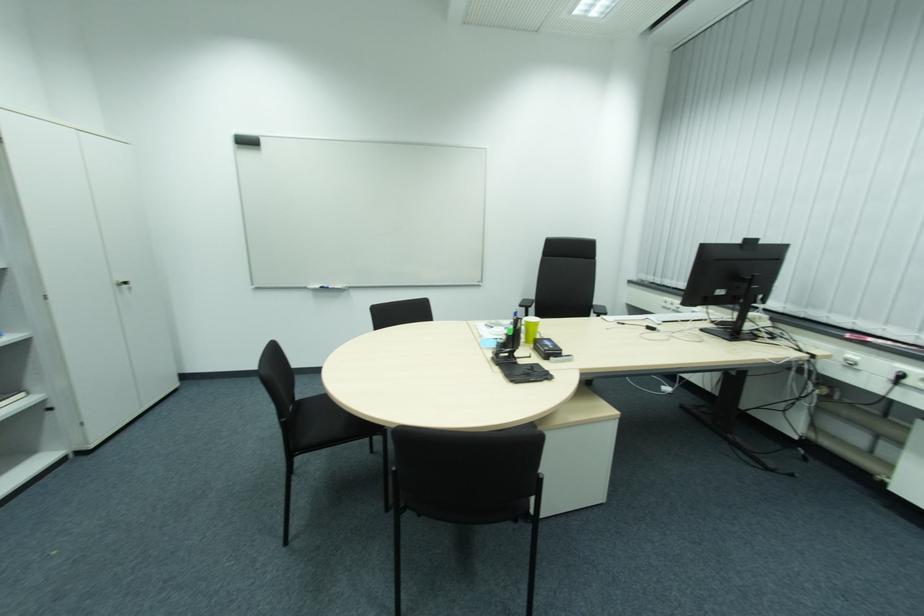
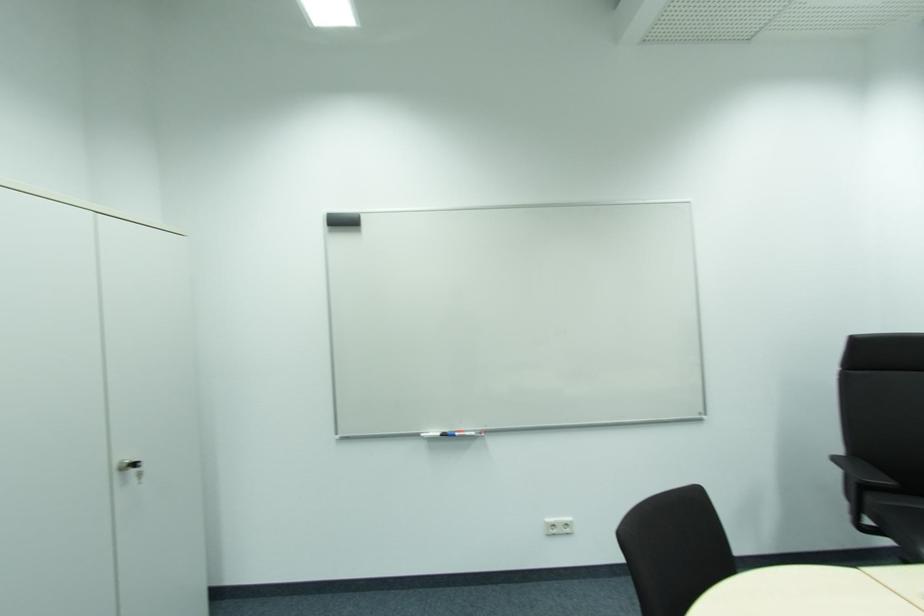
What movement of the cameraman would produce the second image?

The movement direction of the cameraman is left, forward.